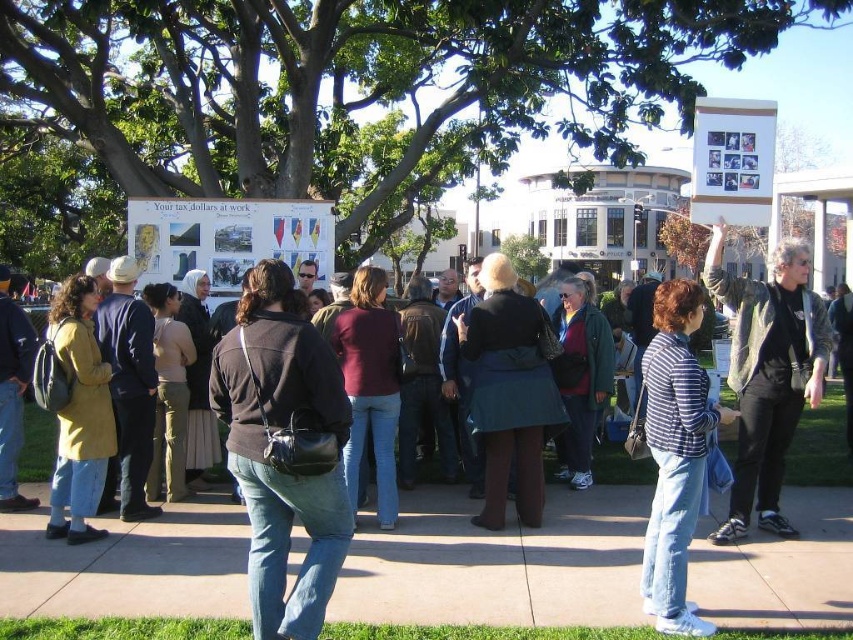
Measure the distance between point [744,497] and camera.

A distance of 6.20 meters exists between point [744,497] and camera.

From the picture: Is gray leather jacket at center further to the viewer compared to striped cotton shirt at center?

That is True.

What do you see at coordinates (769, 374) in the screenshot? The width and height of the screenshot is (853, 640). I see `gray leather jacket at center` at bounding box center [769, 374].

Find the location of a particular element. The image size is (853, 640). gray leather jacket at center is located at coordinates (769, 374).

Between point (227, 388) and point (756, 417), which one is positioned in front?

Point (227, 388) is more forward.

At what (x,y) coordinates should I click in order to perform the action: click on dark brown leather jacket at center. Please return your answer as a coordinate pair (x, y). The image size is (853, 640). Looking at the image, I should click on (267, 444).

At what (x,y) coordinates should I click in order to perform the action: click on dark brown leather jacket at center. Please return your answer as a coordinate pair (x, y). This screenshot has height=640, width=853. Looking at the image, I should click on (267, 444).

Is dark brown leather jacket at center to the right of striped cotton shirt at center from the viewer's perspective?

No, dark brown leather jacket at center is not to the right of striped cotton shirt at center.

Measure the distance between point (321, 490) and camera.

A distance of 4.35 meters exists between point (321, 490) and camera.

Where is `dark brown leather jacket at center`? The image size is (853, 640). dark brown leather jacket at center is located at coordinates click(x=267, y=444).